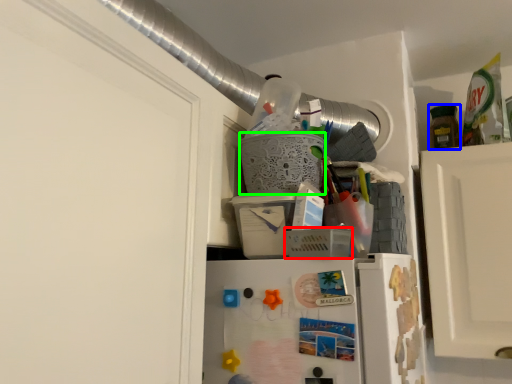
Question: Which is farther away from basket (highlighted by a red box)? bottle (highlighted by a blue box) or basket (highlighted by a green box)?

Choices:
 (A) bottle
 (B) basket

Answer: (A)